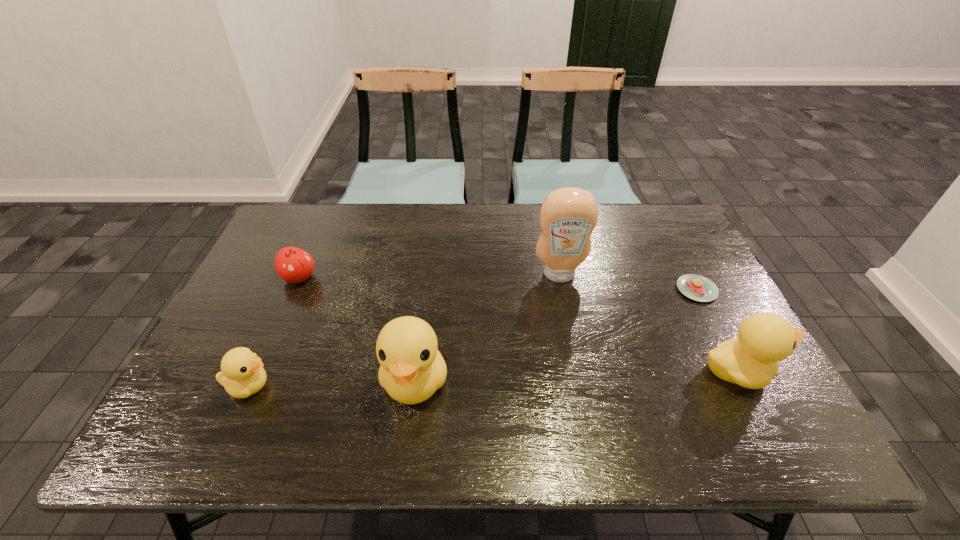
Where is `free point located 0.320m on the back of the pastry`? This screenshot has height=540, width=960. free point located 0.320m on the back of the pastry is located at coordinates (658, 214).

Image resolution: width=960 pixels, height=540 pixels. Find the location of `vacant space located on the front of the apple`. vacant space located on the front of the apple is located at coordinates (276, 332).

This screenshot has width=960, height=540. What are the coordinates of `duck at the left edge` in the screenshot? It's located at (242, 374).

I want to click on apple that is at the left edge, so click(294, 265).

Locate an element on the screen. The width and height of the screenshot is (960, 540). duck that is at the right edge is located at coordinates (751, 360).

This screenshot has width=960, height=540. What are the coordinates of `pastry at the right edge` in the screenshot? It's located at (696, 287).

This screenshot has height=540, width=960. I want to click on object that is at the near left corner, so click(x=242, y=374).

In order to click on object located in the near right corner section of the desktop in this screenshot , I will do `click(751, 360)`.

In the image, there is a desktop. In order to click on vacant space at the far edge in this screenshot , I will do `click(374, 203)`.

What are the coordinates of `blank space at the near edge` in the screenshot? It's located at point(566,408).